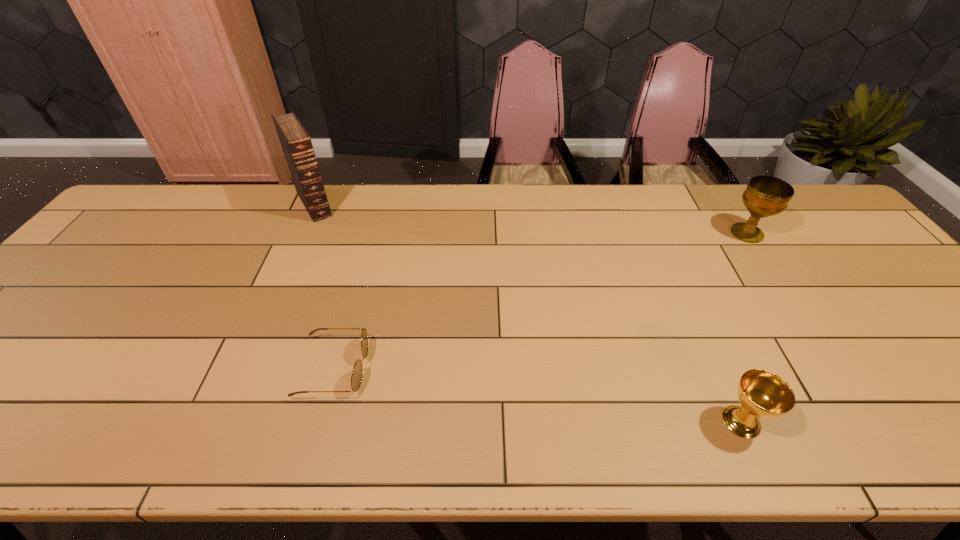
Locate which object ranks third in proximity to the shortest object. Please provide its 2D coordinates. Your answer should be formatted as a tuple, i.e. [(x, y)], where the tuple contains the x and y coordinates of a point satisfying the conditions above.

[(765, 196)]

Select which object appears as the second closest to the Bible. Please provide its 2D coordinates. Your answer should be formatted as a tuple, i.e. [(x, y)], where the tuple contains the x and y coordinates of a point satisfying the conditions above.

[(763, 394)]

At what (x,y) coordinates should I click in order to perform the action: click on free space that satisfies the following two spatial constraints: 1. on the lenses of the second object from left to right; 2. on the right side of the left chalice. Please return your answer as a coordinate pair (x, y). The image size is (960, 540). Looking at the image, I should click on (319, 422).

Locate an element on the screen. The height and width of the screenshot is (540, 960). free space that satisfies the following two spatial constraints: 1. on the lenses of the sunglasses; 2. on the back side of the nearer chalice is located at coordinates (319, 422).